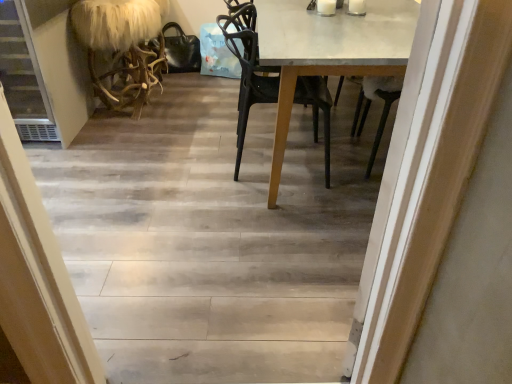
Where is `vacant region to the left of black matte chair at center`? vacant region to the left of black matte chair at center is located at coordinates (179, 160).